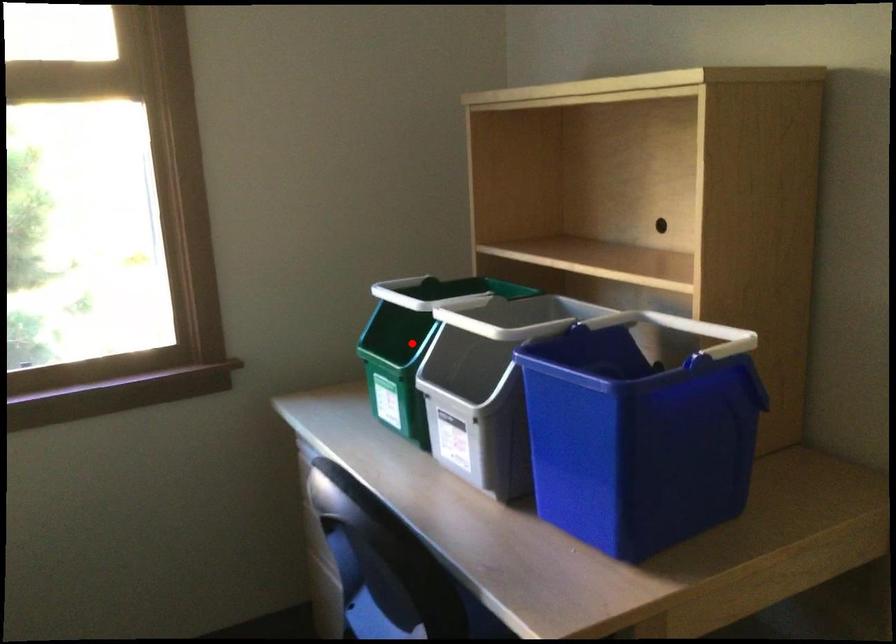
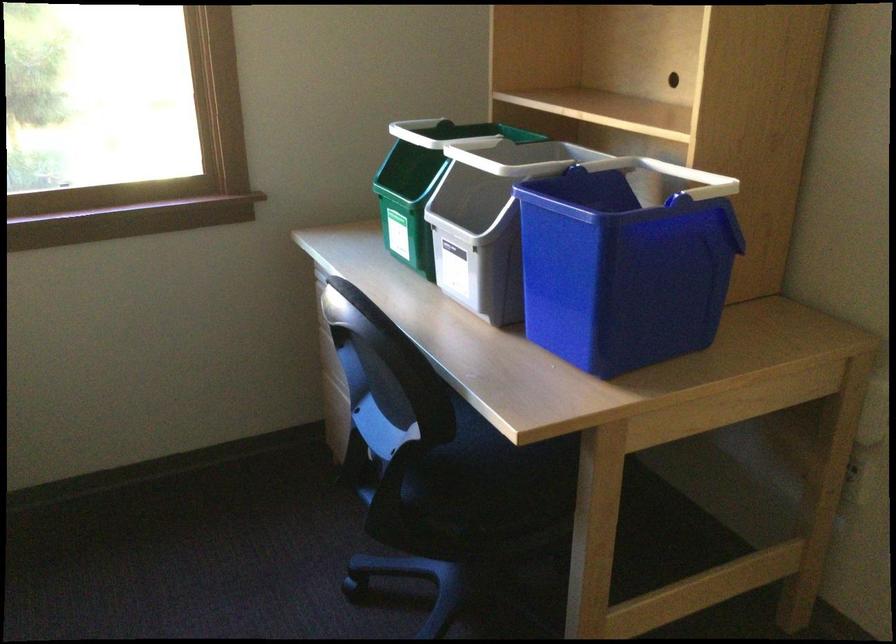
The point at the highlighted location is marked in the first image. Where is the corresponding point in the second image?

(421, 184)